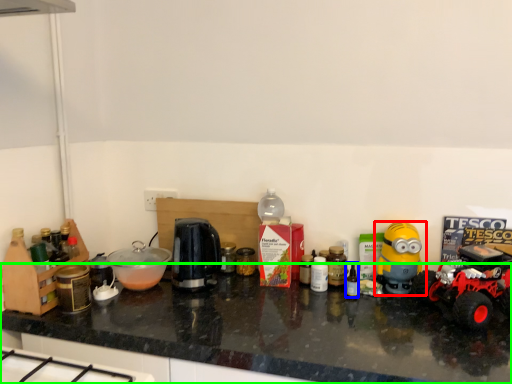
Question: Based on their relative distances, which object is nearer to toy (highlighted by a red box)? Choose from bottle (highlighted by a blue box) and countertop (highlighted by a green box).

Choices:
 (A) bottle
 (B) countertop

Answer: (A)